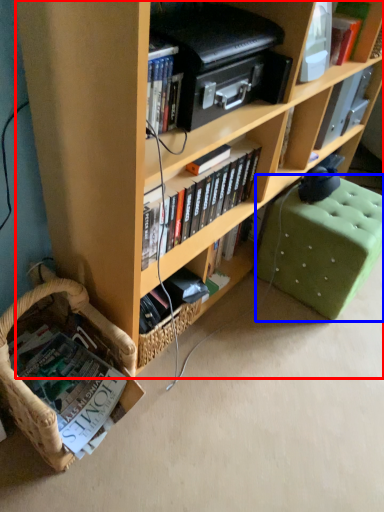
Question: Which of the following is the closest to the observer, bookcase (highlighted by a red box) or swivel chair (highlighted by a blue box)?

Choices:
 (A) bookcase
 (B) swivel chair

Answer: (A)